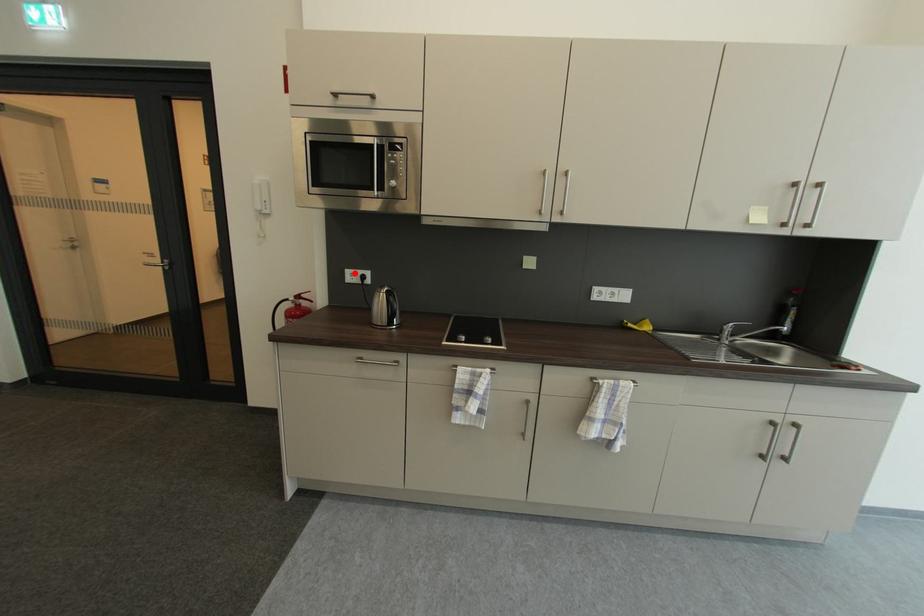
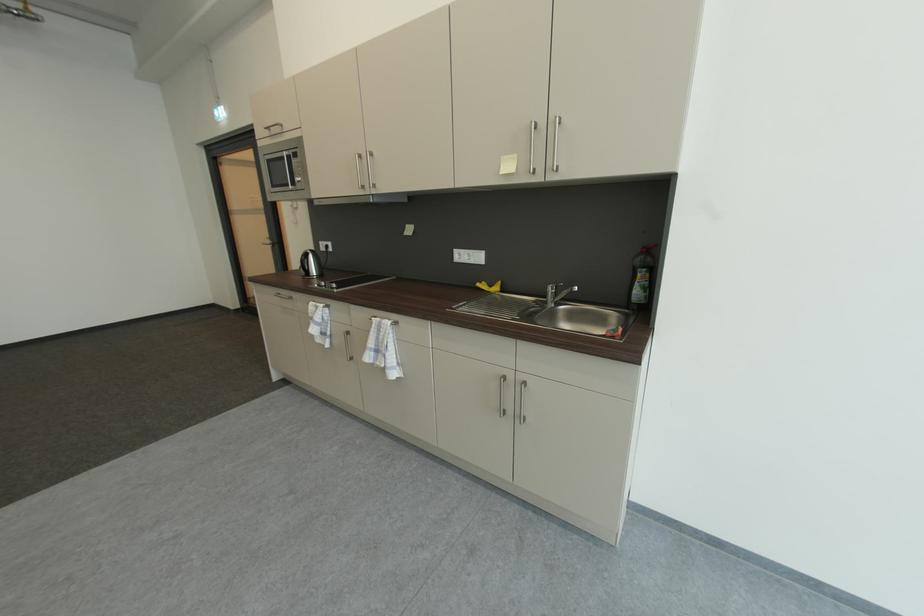
The point at the highlighted location is marked in the first image. Where is the corresponding point in the second image?

(327, 245)